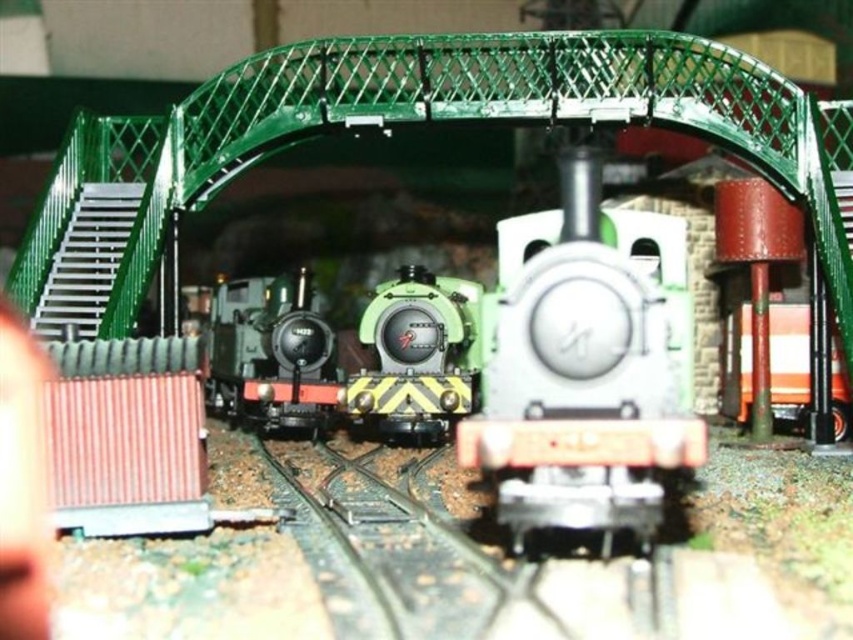
Consider the image. You are a model train enthusiast standing at the entrance of the miniature railway diorama. You notice a specific point marked at coordinates (579, 381). What object is located exactly at that point?

The metallic green train at center is located exactly at point (579, 381).

From the picture: In the model train setup, there are two trains at the center. The metallic green train at center and the green matte train at center. Which one is positioned to the right?

The metallic green train at center is positioned to the right of the green matte train at center.